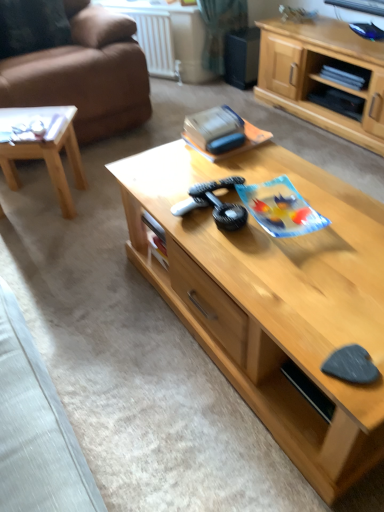
Image resolution: width=384 pixels, height=512 pixels. What are the coordinates of `free space in front of light brown wood coffee table at left, positioned as the 1th coffee table in left-to-right order` in the screenshot? It's located at (49, 244).